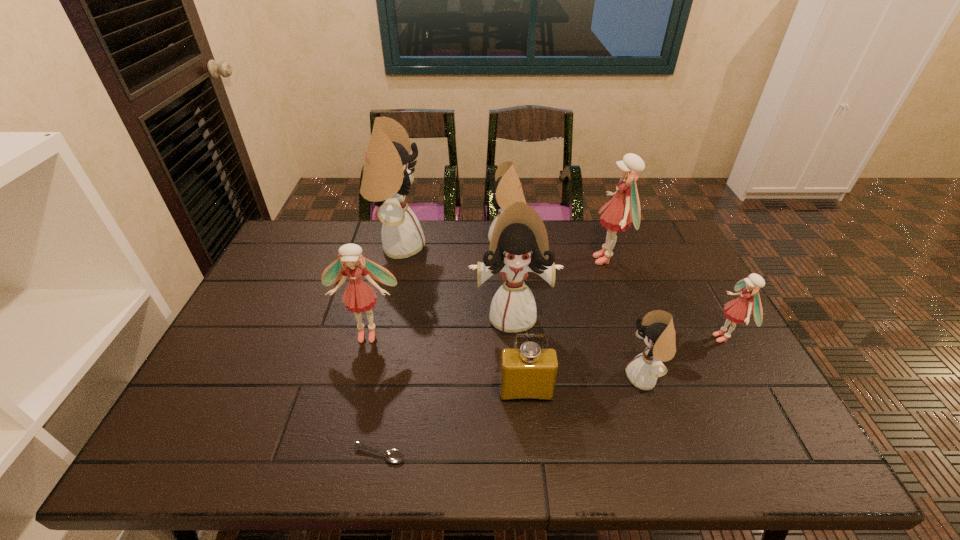
At what (x,y) coordinates should I click in order to perform the action: click on the smallest black doll. Please return your answer as a coordinate pair (x, y). Image resolution: width=960 pixels, height=540 pixels. Looking at the image, I should click on (657, 329).

The height and width of the screenshot is (540, 960). I want to click on perfume, so click(x=528, y=372).

Where is `the nearest object`? the nearest object is located at coordinates (394, 456).

Locate an element on the screen. The width and height of the screenshot is (960, 540). soupspoon is located at coordinates pyautogui.click(x=394, y=456).

Where is `vacant area situated 0.260m at the front face of the tallest doll`? The height and width of the screenshot is (540, 960). vacant area situated 0.260m at the front face of the tallest doll is located at coordinates (501, 246).

Identify the location of vacant space located 0.380m on the front-facing side of the second pink doll from right to left. This screenshot has width=960, height=540. (476, 260).

At what (x,y) coordinates should I click in order to perform the action: click on free space located on the front-facing side of the second pink doll from right to left. Please return your answer as a coordinate pair (x, y). Image resolution: width=960 pixels, height=540 pixels. Looking at the image, I should click on [x=572, y=260].

Find the location of a particular element. free space located on the front-facing side of the second pink doll from right to left is located at coordinates (479, 260).

What are the coordinates of `free space located at the front face of the third smallest black doll` in the screenshot? It's located at (518, 399).

You are a GUI agent. You are given a task and a screenshot of the screen. Output one action in this format:
    pyautogui.click(x=<x>, y=<y>)
    Task: Click on the vacant space located 0.260m at the front face of the second smallest black doll
    The height and width of the screenshot is (540, 960).
    Given the screenshot: What is the action you would take?
    pyautogui.click(x=414, y=242)